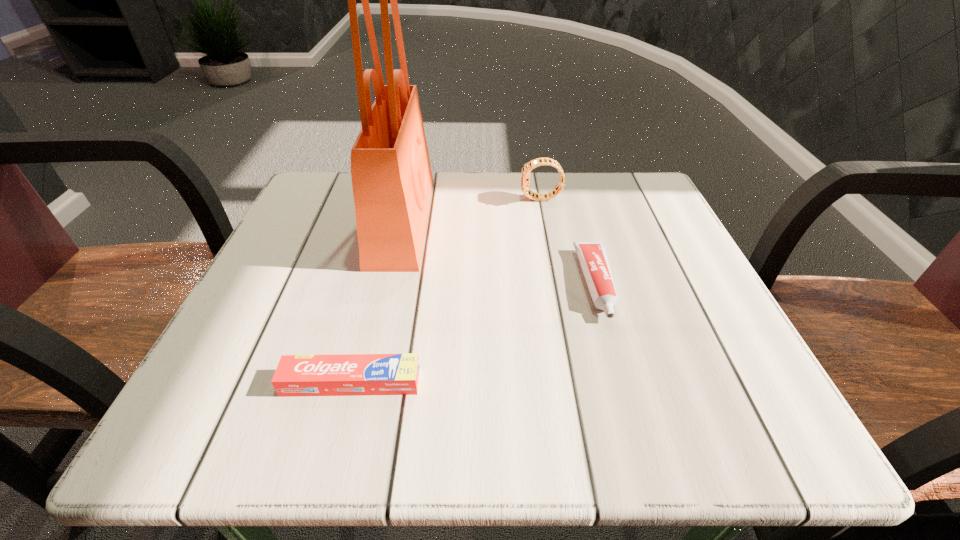
Locate an element on the screen. This screenshot has width=960, height=540. free location located 0.100m on the back of the nearest object is located at coordinates (368, 318).

I want to click on tote bag that is at the far edge, so click(x=392, y=181).

Locate an element on the screen. The image size is (960, 540). watch that is positioned at the far edge is located at coordinates (525, 174).

Locate an element on the screen. The width and height of the screenshot is (960, 540). object situated at the near edge is located at coordinates (345, 374).

The height and width of the screenshot is (540, 960). Identify the location of object present at the left edge. (345, 374).

The width and height of the screenshot is (960, 540). In order to click on object at the right edge in this screenshot , I will do `click(592, 255)`.

I want to click on object situated at the near left corner, so coord(345,374).

You are a GUI agent. You are given a task and a screenshot of the screen. Output one action in this format:
    pyautogui.click(x=<x>, y=<y>)
    Task: Click on the free spot at the far edge of the desktop
    The image size is (960, 540).
    Given the screenshot: What is the action you would take?
    pyautogui.click(x=446, y=183)

Where is `vacant space at the near edge of the desktop`? This screenshot has width=960, height=540. vacant space at the near edge of the desktop is located at coordinates (596, 424).

The image size is (960, 540). I want to click on blank area at the left edge, so click(324, 301).